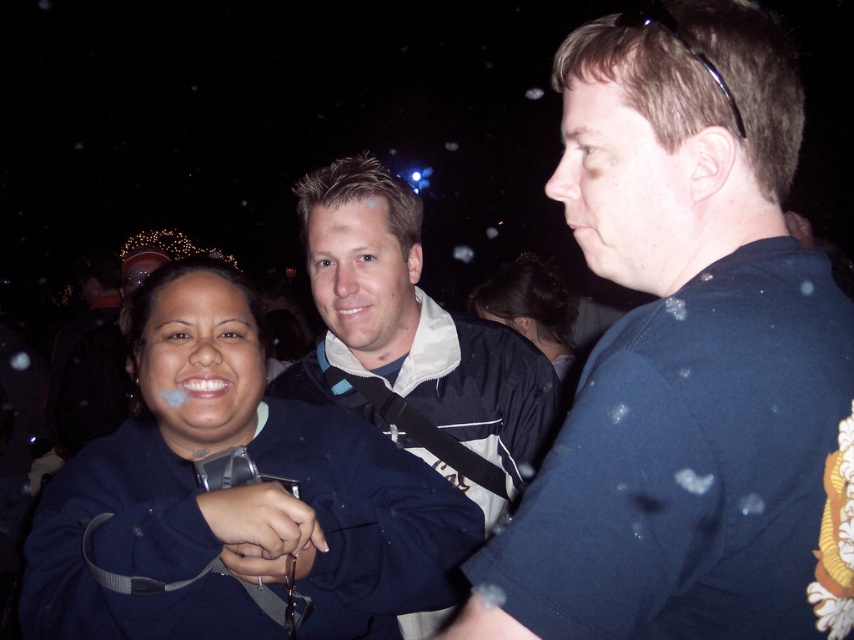
Between dark blue shirt at center and dark brown hair at center, which one appears on the right side from the viewer's perspective?

Positioned to the right is dark brown hair at center.

Identify the location of dark blue shirt at center. point(681,352).

Which is in front, point (525, 433) or point (501, 307)?

Positioned in front is point (525, 433).

Is dark blue jacket at center positioned before dark brown hair at center?

Yes, dark blue jacket at center is in front of dark brown hair at center.

The width and height of the screenshot is (854, 640). What do you see at coordinates (412, 342) in the screenshot?
I see `dark blue jacket at center` at bounding box center [412, 342].

At what (x,y) coordinates should I click in order to perform the action: click on dark blue jacket at center. Please return your answer as a coordinate pair (x, y). The height and width of the screenshot is (640, 854). Looking at the image, I should click on 412,342.

Describe the element at coordinates (234, 497) in the screenshot. This screenshot has height=640, width=854. I see `dark blue fabric shirt at center` at that location.

Find the location of a particular element. The image size is (854, 640). dark blue fabric shirt at center is located at coordinates (234, 497).